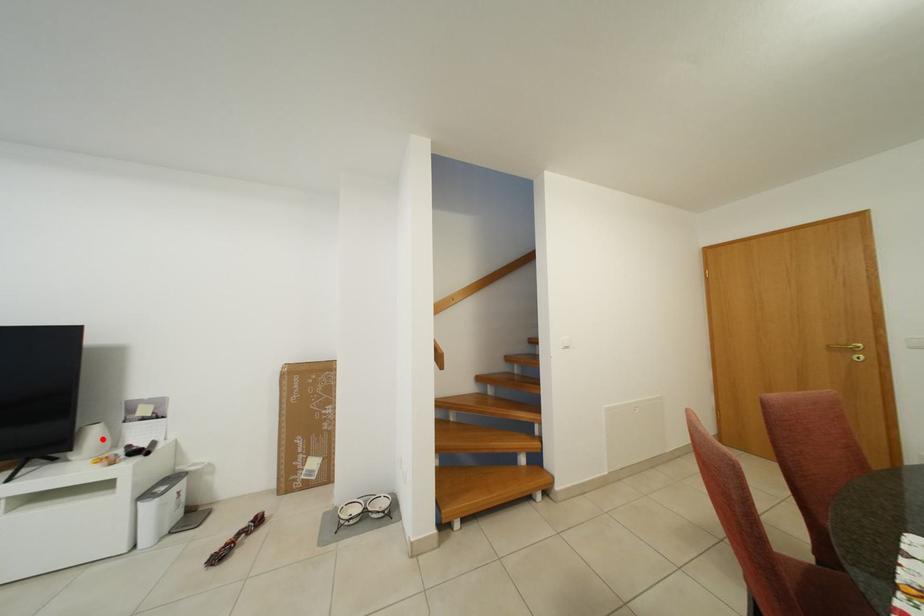
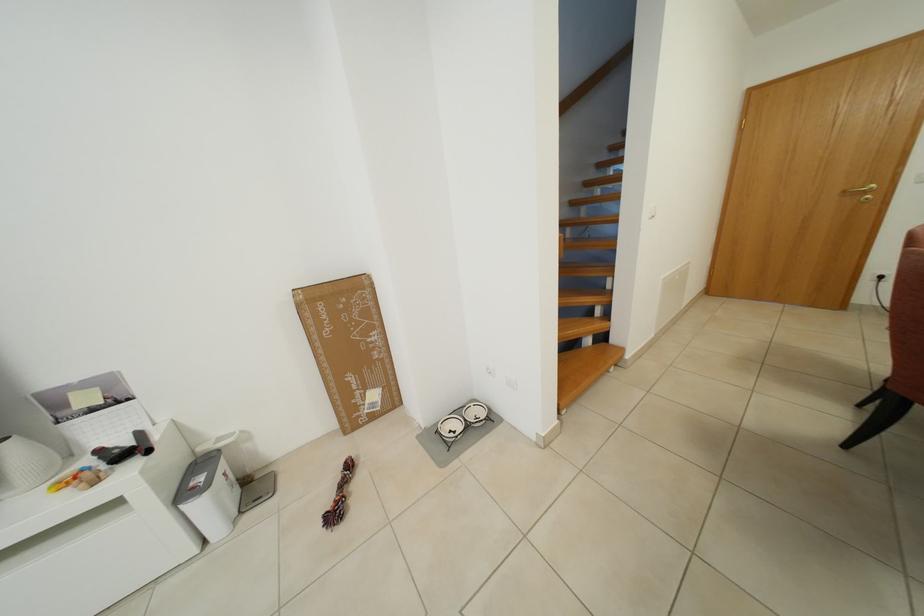
In the second image, find the point that corresponds to the highlighted location in the first image.

(21, 460)